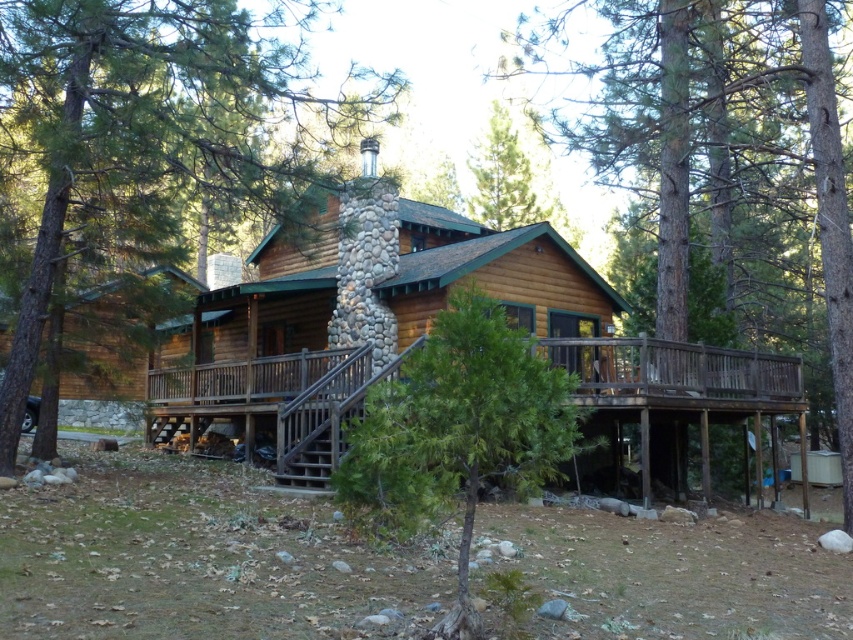
Question: Which point is closer to the camera?

Choices:
 (A) wooden cabin at center
 (B) green textured tree at center

Answer: (B)

Question: Observing the image, what is the correct spatial positioning of smooth brown wood at center in reference to wooden deck at lower center?

Choices:
 (A) right
 (B) left

Answer: (A)

Question: Can you confirm if green leafy tree at center is thinner than wooden deck at lower center?

Choices:
 (A) yes
 (B) no

Answer: (A)

Question: Which is farther from the wooden deck at lower center?

Choices:
 (A) wooden cabin at center
 (B) smooth brown wood at center
 (C) green textured tree at center

Answer: (B)

Question: Estimate the real-world distances between objects in this image. Which object is farther from the wooden deck at lower center?

Choices:
 (A) green leafy tree at center
 (B) smooth brown wood at center

Answer: (A)

Question: Is green leafy tree at center to the right of green textured tree at center from the viewer's perspective?

Choices:
 (A) no
 (B) yes

Answer: (A)